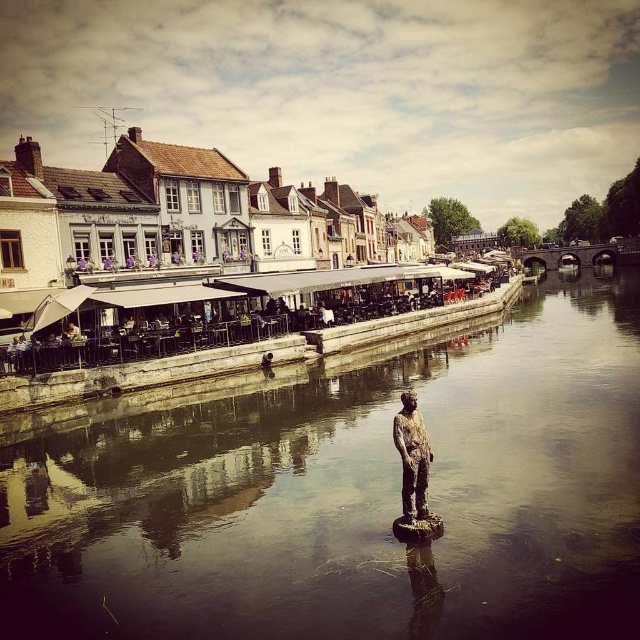
Question: Is smooth reflective water at center below bronze statue at center?

Choices:
 (A) no
 (B) yes

Answer: (B)

Question: Which of the following is the closest to the observer?

Choices:
 (A) (420, 502)
 (B) (410, 364)

Answer: (A)

Question: Can you confirm if smooth reflective water at center is positioned above bronze statue at center?

Choices:
 (A) no
 (B) yes

Answer: (A)

Question: Which point is farther from the camera taking this photo?

Choices:
 (A) (397, 440)
 (B) (125, 596)

Answer: (A)

Question: Considering the relative positions of smooth reflective water at center and bronze statue at center in the image provided, where is smooth reflective water at center located with respect to bronze statue at center?

Choices:
 (A) right
 (B) left

Answer: (A)